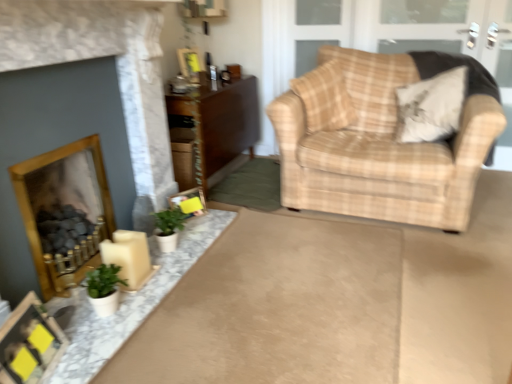
Find the location of a particular element. free space in front of green matte plant at lower left, which appears as the first houseplant when viewed from the front is located at coordinates (90, 337).